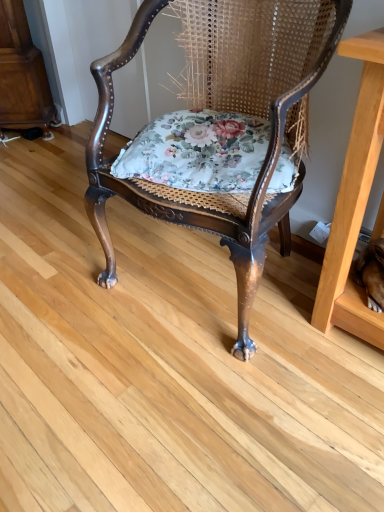
Identify the location of free spot below polished wood chair at center (from a real-world perspective). The width and height of the screenshot is (384, 512). (205, 278).